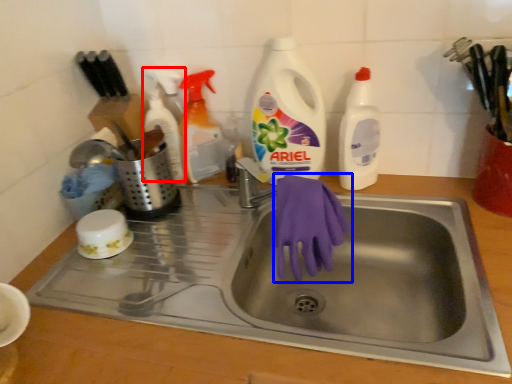
Question: Which object is closer to the camera taking this photo, cleaning product (highlighted by a red box) or glove (highlighted by a blue box)?

Choices:
 (A) cleaning product
 (B) glove

Answer: (B)